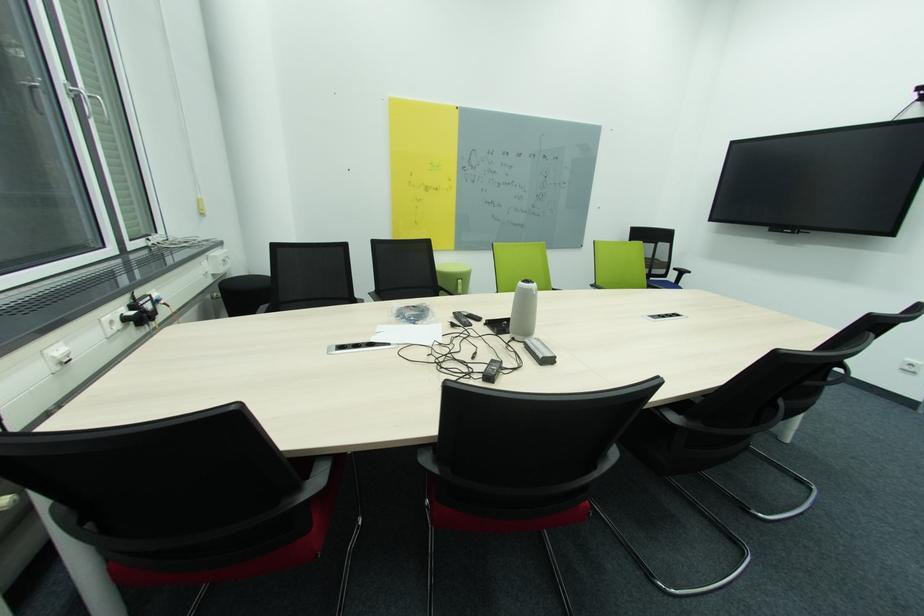
The width and height of the screenshot is (924, 616). What do you see at coordinates (86, 99) in the screenshot? I see `the white window handle` at bounding box center [86, 99].